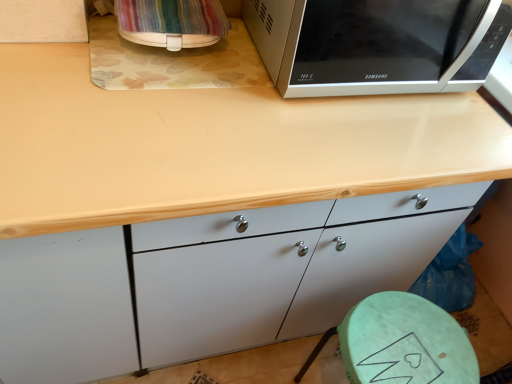
Locate an element on the screen. Image resolution: width=512 pixels, height=384 pixels. blank space to the left of striped fabric bag at upper left is located at coordinates click(x=84, y=40).